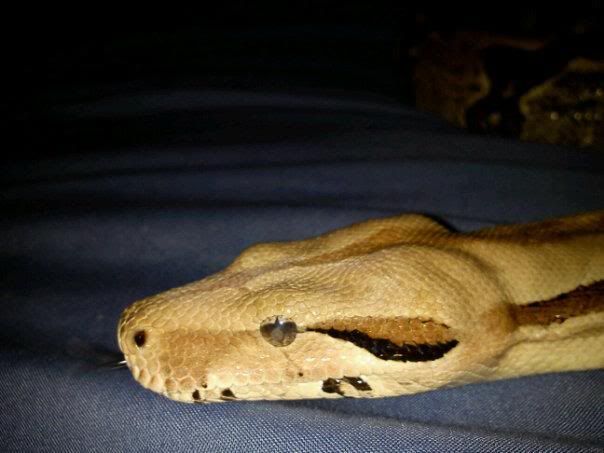
In order to click on dark blue fabric surface in this screenshot , I will do `click(190, 429)`.